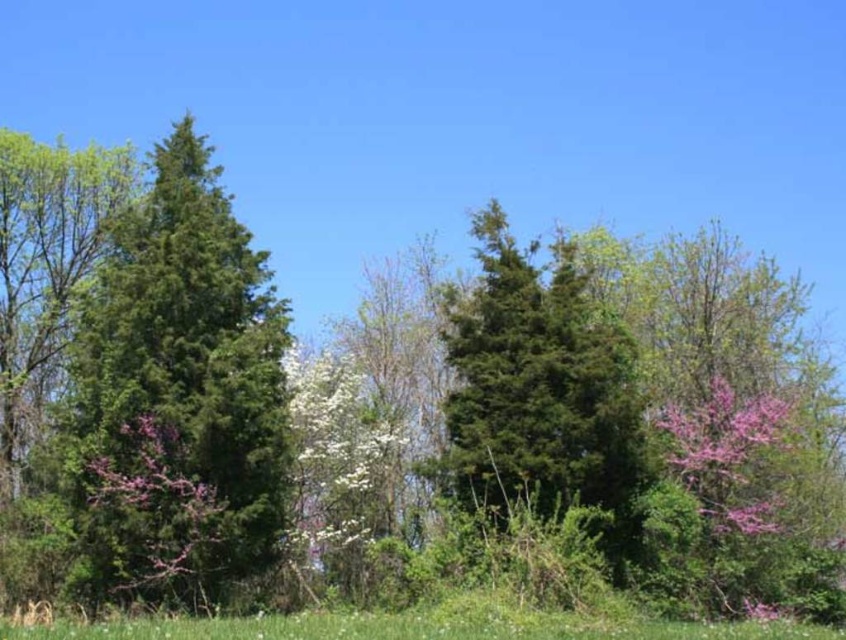
Does green needle-like at center have a greater width compared to green grass at lower center?

No.

Find the location of a particular element. The height and width of the screenshot is (640, 846). green needle-like at center is located at coordinates (541, 394).

Can you confirm if green needle-like tree at left is positioned above green grass at lower center?

Yes, green needle-like tree at left is above green grass at lower center.

Is green needle-like tree at left thinner than green grass at lower center?

Yes.

Who is more distant from viewer, (275, 515) or (415, 634)?

The point (275, 515) is more distant.

The image size is (846, 640). Identify the location of green needle-like tree at left. (179, 396).

In the scene shown: Is the position of green needle-like tree at left more distant than that of green needle-like at center?

Yes, it is behind green needle-like at center.

Does green needle-like tree at left appear on the right side of green needle-like at center?

In fact, green needle-like tree at left is to the left of green needle-like at center.

Where is `green needle-like tree at left`? The width and height of the screenshot is (846, 640). green needle-like tree at left is located at coordinates coord(179,396).